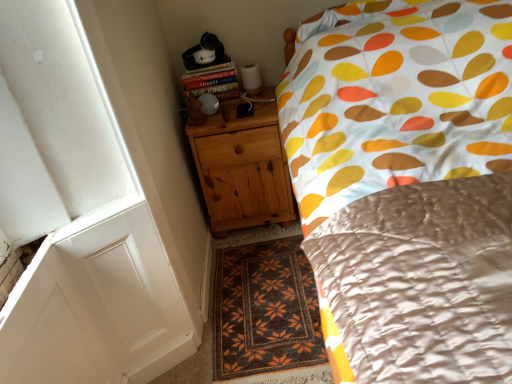
The height and width of the screenshot is (384, 512). I want to click on vacant point above hardcover book at upper left (from a real-world perspective), so click(x=212, y=70).